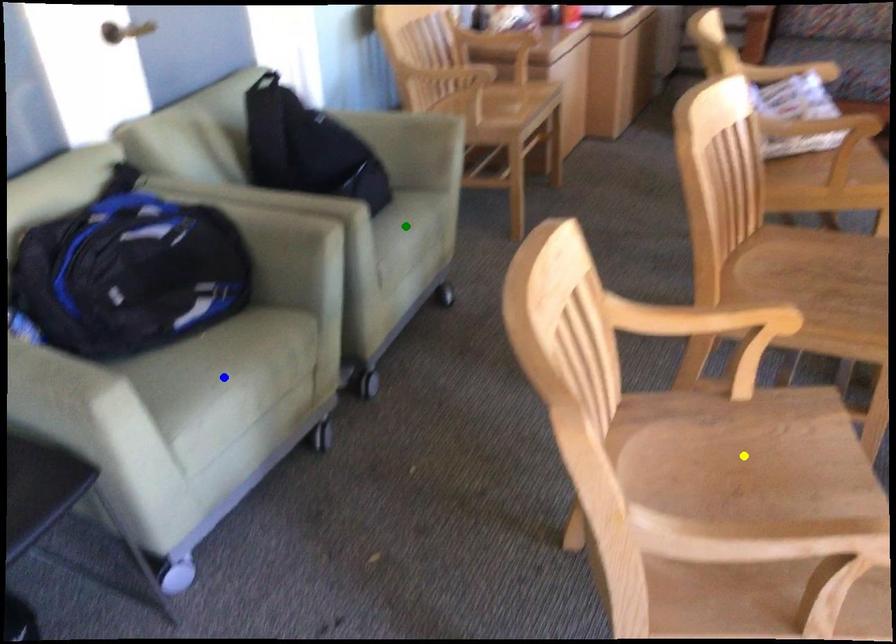
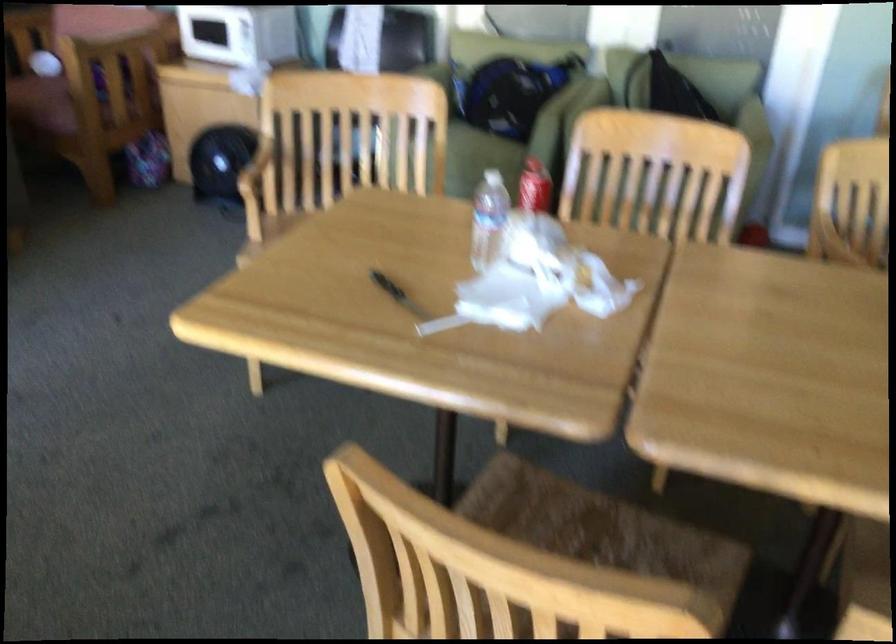
I am providing you with two images of the same scene from different viewpoints. Three points are marked in image1. Which point corresponds to a part or object that is occluded in image2?In image1, three points are marked. Which of them correspond to a part or object that is occluded in image2?Among the three points shown in image1, which one corresponds to a part or object that is no longer visible due to occlusion in image2?

Invisible in image2: yellow point, green point, blue point.